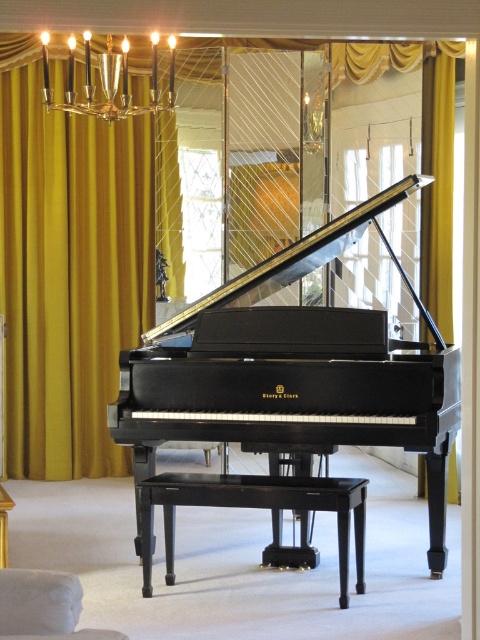
Question: Which object appears farthest from the camera in this image?

Choices:
 (A) white fabric armchair at lower left
 (B) yellow velvet curtain at upper left
 (C) gold velvet curtain at left
 (D) black polished wood stool at center

Answer: (C)

Question: Which point is closer to the camera?

Choices:
 (A) white fabric armchair at lower left
 (B) black polished wood stool at center

Answer: (A)

Question: Is black polished wood stool at center above white fabric armchair at lower left?

Choices:
 (A) yes
 (B) no

Answer: (B)

Question: Does yellow velvet curtain at upper left lie behind gold velvet curtain at left?

Choices:
 (A) yes
 (B) no

Answer: (B)

Question: Among these objects, which one is farthest from the camera?

Choices:
 (A) black polished piano at center
 (B) black polished wood stool at center
 (C) gold velvet curtain at left
 (D) yellow velvet curtain at upper left

Answer: (C)

Question: Is yellow velvet curtain at upper left above white fabric armchair at lower left?

Choices:
 (A) no
 (B) yes

Answer: (B)